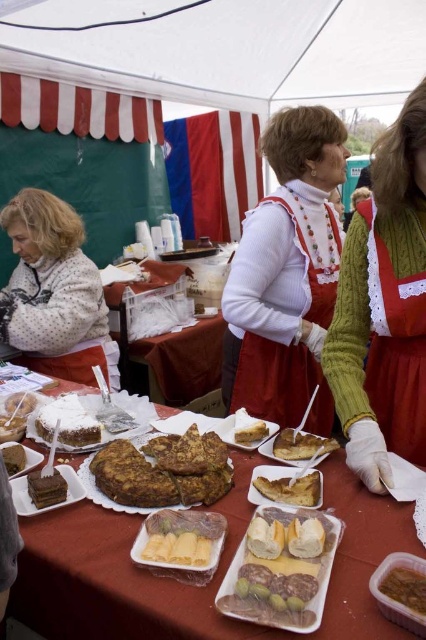
Which of these two, brown crumbly cake at center or powdery white cake at lower left, stands taller?

Standing taller between the two is brown crumbly cake at center.

Is brown crumbly cake at center in front of powdery white cake at lower left?

Yes, brown crumbly cake at center is closer to the viewer.

Is point (187, 429) less distant than point (91, 433)?

No, (187, 429) is further to viewer.

Where is `brown crumbly cake at center`? brown crumbly cake at center is located at coordinates (164, 470).

Does translucent plastic tray at center have a lesser height compared to golden brown cake at center?

In fact, translucent plastic tray at center may be taller than golden brown cake at center.

Is translucent plastic tray at center above golden brown cake at center?

Actually, translucent plastic tray at center is below golden brown cake at center.

The image size is (426, 640). What are the coordinates of `translucent plastic tray at center` in the screenshot? It's located at (121, 577).

Where is `translucent plastic tray at center`? This screenshot has height=640, width=426. translucent plastic tray at center is located at coordinates (121, 577).

Can you confirm if white dotted sweater at lower left is positioned to the right of brown crumbly bread at center?

No, white dotted sweater at lower left is not to the right of brown crumbly bread at center.

Between point (75, 333) and point (264, 486), which one is positioned behind?

Point (75, 333)

Who is more forward, [55,301] or [307,502]?

Point [307,502] is in front.

Find the location of `white dotted sweater at lower left`. white dotted sweater at lower left is located at coordinates (54, 291).